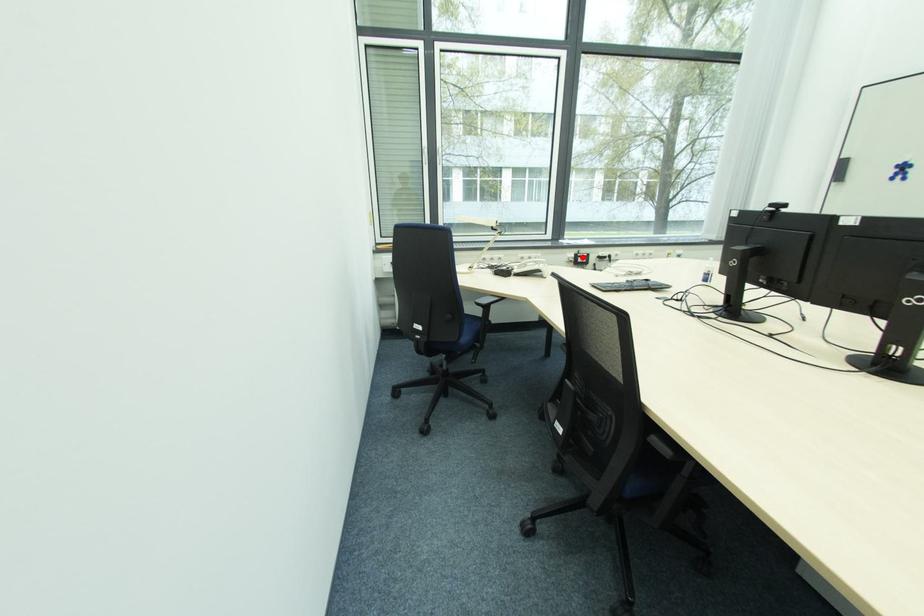
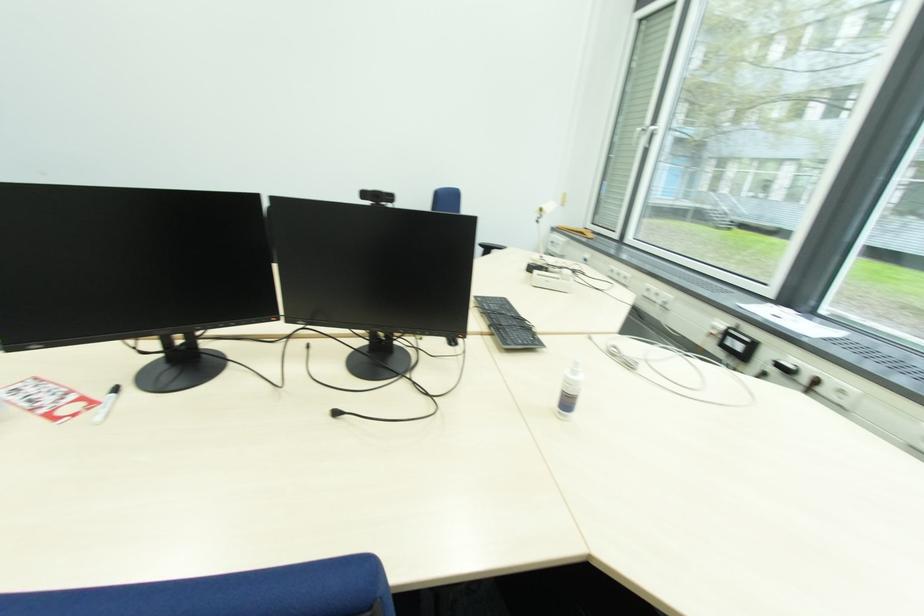
In the second image, find the point that corresponds to the highlighted location in the first image.

(734, 333)